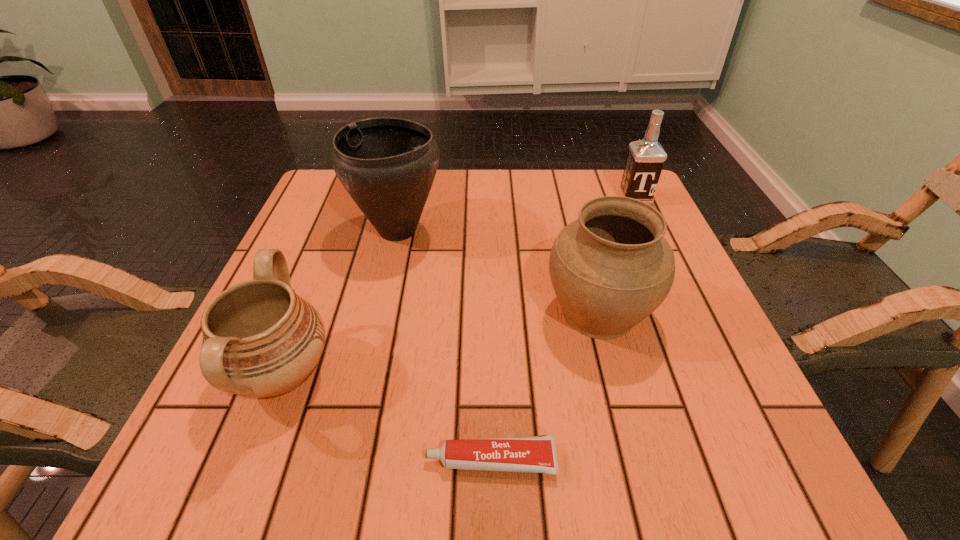
Where is `vacant space located at the nozzle of the toothpaste`? vacant space located at the nozzle of the toothpaste is located at coordinates (198, 460).

What are the coordinates of `urn positioned at the far edge` in the screenshot? It's located at (387, 165).

Image resolution: width=960 pixels, height=540 pixels. Identify the location of vodka that is at the far edge. (645, 160).

Find the location of a particular element. The width and height of the screenshot is (960, 540). urn at the near edge is located at coordinates (260, 339).

Find the location of a particular element. This screenshot has height=540, width=960. toothpaste located in the near edge section of the desktop is located at coordinates (537, 454).

The image size is (960, 540). What are the coordinates of `vodka present at the right edge` in the screenshot? It's located at (645, 160).

You are a GUI agent. You are given a task and a screenshot of the screen. Output one action in this format:
    pyautogui.click(x=<x>, y=<y>)
    Task: Click on the urn located at the right edge
    This screenshot has height=540, width=960.
    Given the screenshot: What is the action you would take?
    point(611,268)

I want to click on object located at the far left corner, so click(x=387, y=165).

You are a GUI agent. You are given a task and a screenshot of the screen. Output one action in this format:
    pyautogui.click(x=<x>, y=<y>)
    Task: Click on the object located at the near left corner
    The width and height of the screenshot is (960, 540).
    Given the screenshot: What is the action you would take?
    pyautogui.click(x=260, y=339)

This screenshot has height=540, width=960. Identify the location of object that is positioned at the far right corner. 645,160.